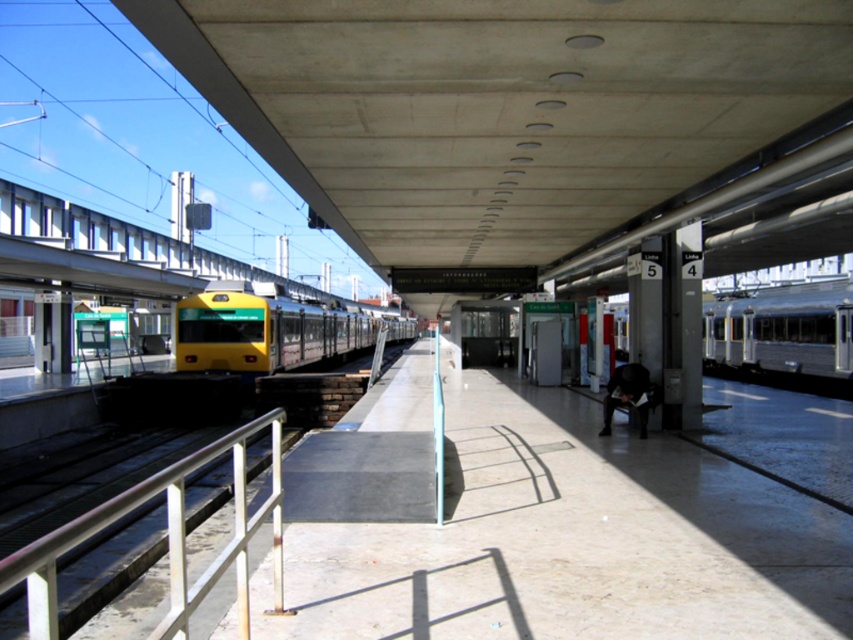
Question: Among these points, which one is farthest from the camera?

Choices:
 (A) (842, 381)
 (B) (344, 314)
 (C) (242, 560)

Answer: (B)

Question: Which object appears closest to the camera in this image?

Choices:
 (A) silver metallic train at right
 (B) yellow metallic train at center
 (C) white metal rail at lower left

Answer: (C)

Question: Among these objects, which one is farthest from the camera?

Choices:
 (A) silver metallic train at right
 (B) white metal rail at lower left
 (C) yellow metallic train at center

Answer: (C)

Question: Where is white metal rail at lower left located in relation to yellow metallic train at center in the image?

Choices:
 (A) below
 (B) above

Answer: (A)

Question: Does silver metallic train at right have a larger size compared to yellow metallic train at center?

Choices:
 (A) yes
 (B) no

Answer: (A)

Question: Can you confirm if white metal rail at lower left is positioned below silver metallic train at right?

Choices:
 (A) no
 (B) yes

Answer: (B)